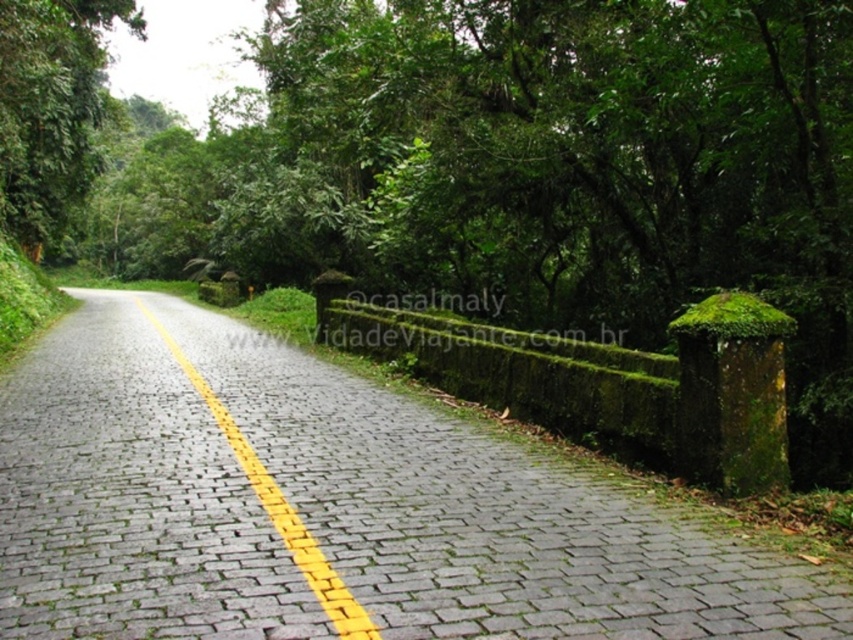
You are a hiker standing on the mossy stone wall on the right side of the road. You see a point marked at coordinates (332, 508). Where is this point located relative to your current position?

The point (332, 508) is on the gray cobblestone road at center, so it is located directly in front of you on the road below the mossy stone wall where you are standing.

You are a hiker walking along the gray cobblestone road at center and the yellowsmoothline at center. Which one is closer to the ground?

The gray cobblestone road at center is located below the yellowsmoothline at center, so the gray cobblestone road at center is closer to the ground.